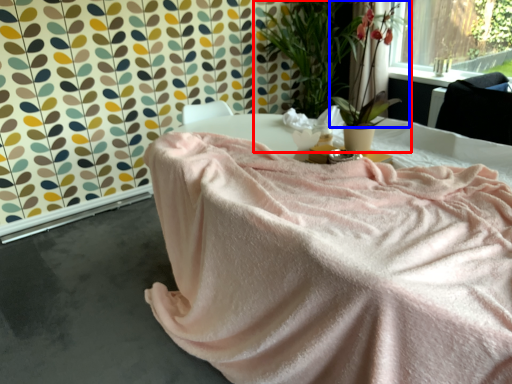
Question: Among these objects, which one is farthest to the camera, houseplant (highlighted by a red box) or floral arrangement (highlighted by a blue box)?

Choices:
 (A) houseplant
 (B) floral arrangement

Answer: (B)